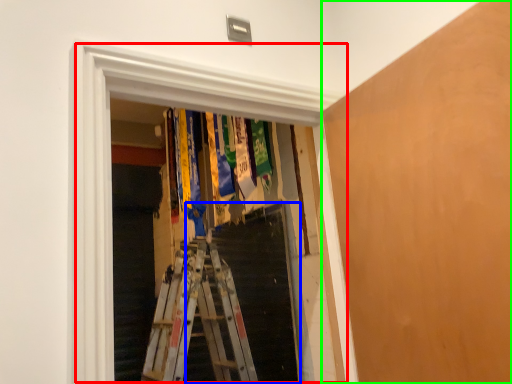
Question: Which is farther away from window (highlighted by a red box)? stairs (highlighted by a blue box) or plywood (highlighted by a green box)?

Choices:
 (A) stairs
 (B) plywood

Answer: (A)